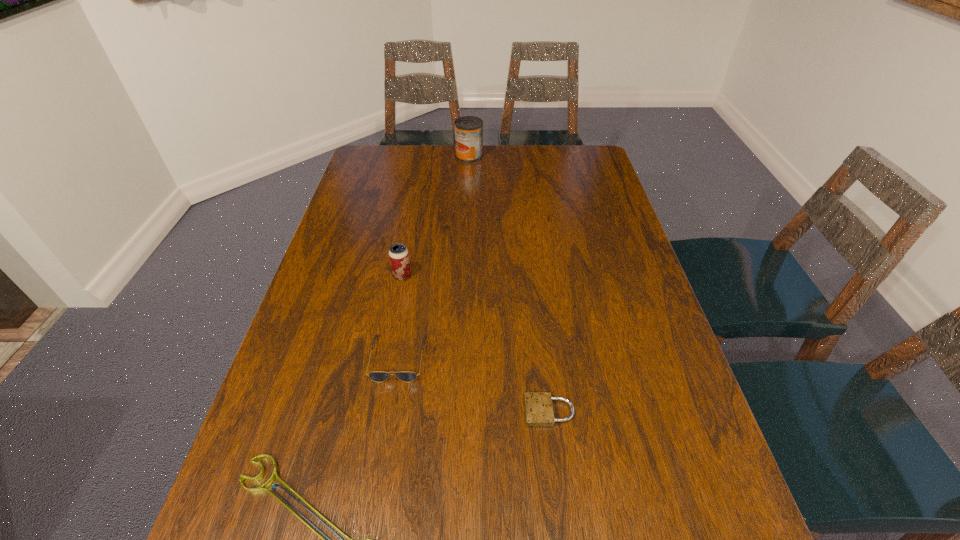
Find the location of `empty location between the second tallest object and the sunglasses`. empty location between the second tallest object and the sunglasses is located at coordinates (400, 316).

Where is `free area in between the fourth farthest object and the can`? This screenshot has width=960, height=540. free area in between the fourth farthest object and the can is located at coordinates (509, 284).

Locate an element on the screen. free spot between the third tallest object and the fourth object from left to right is located at coordinates (434, 257).

Identify which object is located as the fourth nearest to the shortest object. Please provide its 2D coordinates. Your answer should be formatted as a tuple, i.e. [(x, y)], where the tuple contains the x and y coordinates of a point satisfying the conditions above.

[(468, 129)]

I want to click on the fourth closest object to the third farthest object, so click(x=468, y=129).